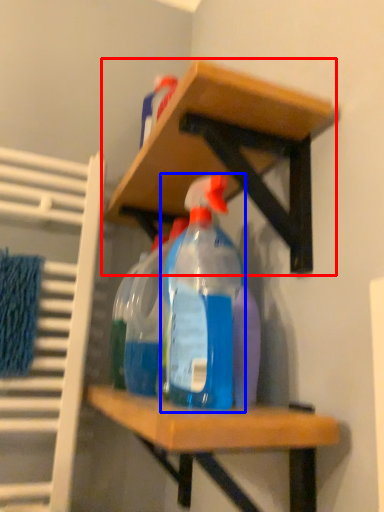
Question: Which of the following is the farthest to the observer, shelf (highlighted by a red box) or bottle (highlighted by a blue box)?

Choices:
 (A) shelf
 (B) bottle

Answer: (B)